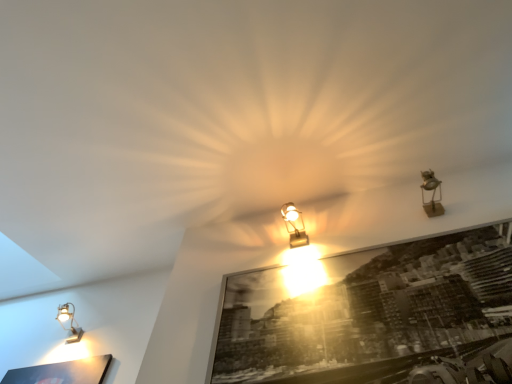
Question: From a real-world perspective, is matte silver lamp at lower left, arranged as the 1th lamp when viewed from the left, physically below metallic gold spotlight at upper right, the first lamp when ordered from right to left?

Choices:
 (A) yes
 (B) no

Answer: (B)

Question: From the image's perspective, is matte silver lamp at lower left, which is counted as the 3th lamp, starting from the top, above metallic gold spotlight at upper right, the 3th lamp positioned from the back?

Choices:
 (A) no
 (B) yes

Answer: (A)

Question: From a real-world perspective, does matte silver lamp at lower left, the third lamp in the front-to-back sequence, stand above metallic gold spotlight at upper right, marked as the third lamp in a left-to-right arrangement?

Choices:
 (A) yes
 (B) no

Answer: (A)

Question: Considering the relative positions of matte silver lamp at lower left, the third lamp in the front-to-back sequence, and metallic gold spotlight at upper right, the third lamp ordered from the bottom, in the image provided, is matte silver lamp at lower left, the third lamp in the front-to-back sequence, in front of metallic gold spotlight at upper right, the third lamp ordered from the bottom,?

Choices:
 (A) yes
 (B) no

Answer: (B)

Question: Is matte silver lamp at lower left, which is the 1th lamp in bottom-to-top order, far away from metallic gold spotlight at upper right, the 1th lamp when ordered from front to back?

Choices:
 (A) no
 (B) yes

Answer: (B)

Question: From a real-world perspective, is metallic gold spotlight at upper right, the third lamp ordered from the bottom, positioned above or below black glossy picture frame at center?

Choices:
 (A) above
 (B) below

Answer: (A)

Question: Does point (431, 196) appear closer or farther from the camera than point (495, 233)?

Choices:
 (A) closer
 (B) farther

Answer: (B)

Question: Is metallic gold spotlight at upper right, the third lamp ordered from the bottom, inside the boundaries of black glossy picture frame at center, or outside?

Choices:
 (A) inside
 (B) outside

Answer: (B)

Question: Based on their sizes in the image, would you say metallic gold spotlight at upper right, the 3th lamp positioned from the back, is bigger or smaller than black glossy picture frame at center?

Choices:
 (A) big
 (B) small

Answer: (B)

Question: Looking at their shapes, would you say matte silver lamp at lower left, which is the 1th lamp in bottom-to-top order, is wider or thinner than matte gold lamp at center, the second lamp ordered from the bottom?

Choices:
 (A) wide
 (B) thin

Answer: (A)

Question: Is matte silver lamp at lower left, which is the 1th lamp in bottom-to-top order, bigger or smaller than matte gold lamp at center, the second lamp viewed from the top?

Choices:
 (A) small
 (B) big

Answer: (A)

Question: Is matte silver lamp at lower left, the third lamp in the front-to-back sequence, situated inside matte gold lamp at center, placed as the second lamp when sorted from front to back, or outside?

Choices:
 (A) inside
 (B) outside

Answer: (B)

Question: From the image's perspective, relative to matte gold lamp at center, the 2th lamp in the left-to-right sequence, is matte silver lamp at lower left, arranged as the 1th lamp when viewed from the back, above or below?

Choices:
 (A) above
 (B) below

Answer: (B)

Question: Looking at their shapes, would you say matte gold lamp at center, placed as the second lamp when sorted from front to back, is wider or thinner than matte silver lamp at lower left, arranged as the 1th lamp when viewed from the left?

Choices:
 (A) thin
 (B) wide

Answer: (A)

Question: Is matte gold lamp at center, placed as the 2th lamp when sorted from back to front, to the left or to the right of matte silver lamp at lower left, arranged as the 1th lamp when viewed from the back, in the image?

Choices:
 (A) right
 (B) left

Answer: (A)